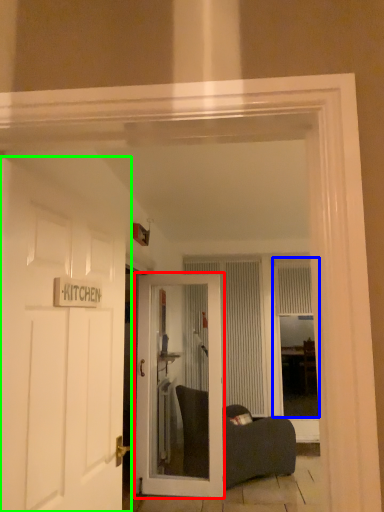
Question: Estimate the real-world distances between objects in this image. Which object is closer to door (highlighted by a red box), window (highlighted by a blue box) or door (highlighted by a green box)?

Choices:
 (A) window
 (B) door

Answer: (A)